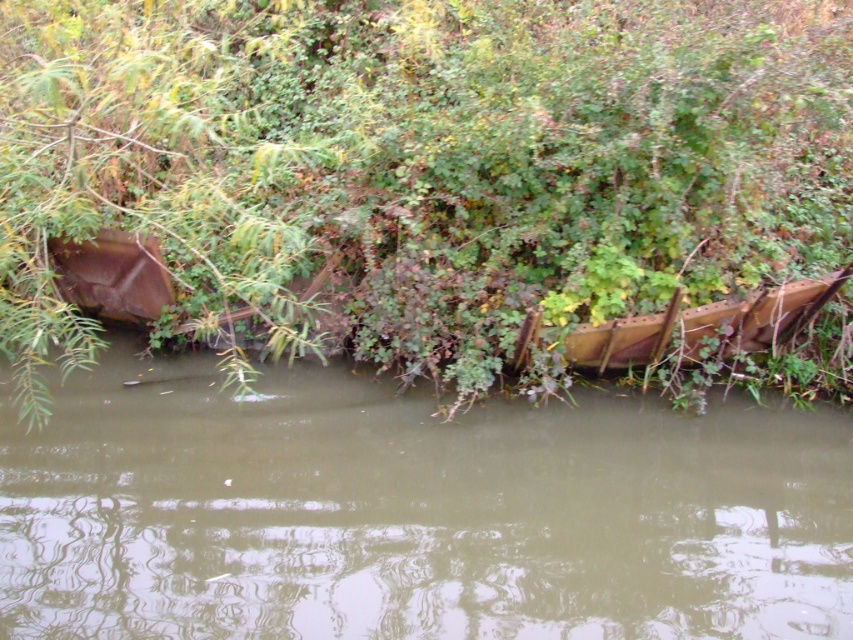
Measure the distance between green matte tree at upper left and rusty metal boat at center.

A distance of 1.02 meters exists between green matte tree at upper left and rusty metal boat at center.

This screenshot has height=640, width=853. What do you see at coordinates (421, 161) in the screenshot? I see `green matte tree at upper left` at bounding box center [421, 161].

Locate an element on the screen. Image resolution: width=853 pixels, height=640 pixels. green matte tree at upper left is located at coordinates (421, 161).

Find the location of `green matte tree at upper left`. green matte tree at upper left is located at coordinates (x=421, y=161).

The height and width of the screenshot is (640, 853). What do you see at coordinates (421, 161) in the screenshot? I see `green matte tree at upper left` at bounding box center [421, 161].

Is green matte tree at upper left to the right of brown wooden boat at center from the viewer's perspective?

Incorrect, green matte tree at upper left is not on the right side of brown wooden boat at center.

Between point (477, 388) and point (370, 557), which one is positioned behind?

Positioned behind is point (477, 388).

Locate an element on the screen. Image resolution: width=853 pixels, height=640 pixels. green matte tree at upper left is located at coordinates (421, 161).

Which is below, brown wooden boat at center or rusty metal boat at center?

brown wooden boat at center is below.

Is point (695, 632) positioned after point (846, 266)?

No, (695, 632) is in front of (846, 266).

Is point (502, 557) less distant than point (643, 336)?

Yes, point (502, 557) is closer to viewer.

Find the location of `brown wooden boat at center`. brown wooden boat at center is located at coordinates (415, 513).